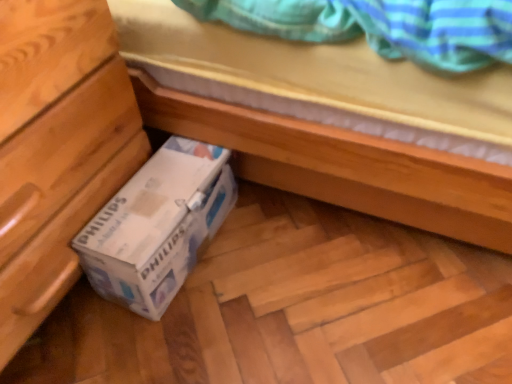
Question: Considering their positions, is wooden chest of drawers at lower left located in front of or behind white cardboard box at lower left?

Choices:
 (A) front
 (B) behind

Answer: (A)

Question: Would you say wooden chest of drawers at lower left is to the left or to the right of white cardboard box at lower left in the picture?

Choices:
 (A) right
 (B) left

Answer: (B)

Question: From their relative heights in the image, would you say wooden chest of drawers at lower left is taller or shorter than white cardboard box at lower left?

Choices:
 (A) short
 (B) tall

Answer: (B)

Question: From the image's perspective, is white cardboard box at lower left positioned above or below wooden chest of drawers at lower left?

Choices:
 (A) below
 (B) above

Answer: (A)

Question: Relative to wooden chest of drawers at lower left, is white cardboard box at lower left in front or behind?

Choices:
 (A) front
 (B) behind

Answer: (B)

Question: In terms of size, does white cardboard box at lower left appear bigger or smaller than wooden chest of drawers at lower left?

Choices:
 (A) small
 (B) big

Answer: (A)

Question: Considering the relative positions of white cardboard box at lower left and wooden chest of drawers at lower left in the image provided, is white cardboard box at lower left to the left or to the right of wooden chest of drawers at lower left?

Choices:
 (A) right
 (B) left

Answer: (A)